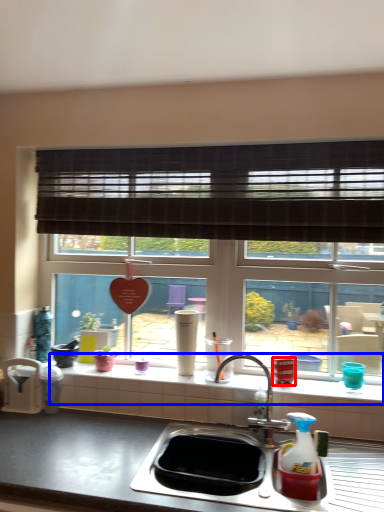
Question: Which object appears closest to the camera in this image, appliance (highlighted by a red box) or window sill (highlighted by a blue box)?

Choices:
 (A) appliance
 (B) window sill

Answer: (B)